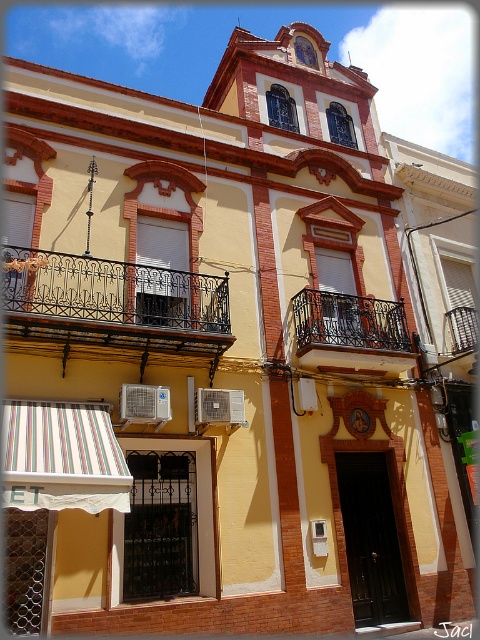
Which is below, black wrought iron balcony at upper left or black wrought iron balcony at center?

black wrought iron balcony at center is lower down.

Can you confirm if black wrought iron balcony at upper left is wider than black wrought iron balcony at center?

Indeed, black wrought iron balcony at upper left has a greater width compared to black wrought iron balcony at center.

Where is `black wrought iron balcony at upper left`? The height and width of the screenshot is (640, 480). black wrought iron balcony at upper left is located at coordinates (113, 301).

What are the coordinates of `black wrought iron balcony at upper left` in the screenshot? It's located at (113, 301).